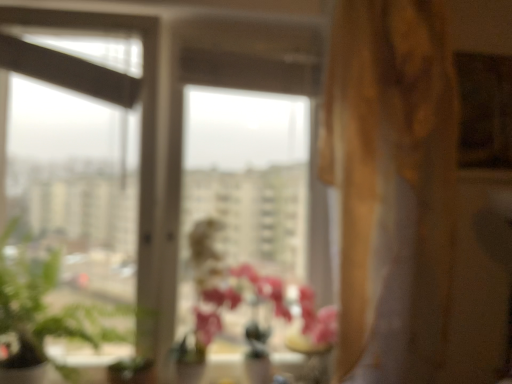
Question: From the image's perspective, is pink matte vase at center located above or below transparent glass vase at center?

Choices:
 (A) below
 (B) above

Answer: (B)

Question: Is pink matte vase at center in front of or behind transparent glass vase at center in the image?

Choices:
 (A) behind
 (B) front

Answer: (B)

Question: Based on their relative distances, which object is nearer to the gold textured curtain at right?

Choices:
 (A) pink matte vase at center
 (B) transparent glass vase at center
 (C) transparent glass window at center
 (D) green leafy plant at left

Answer: (A)

Question: Which object is the farthest from the gold textured curtain at right?

Choices:
 (A) green leafy plant at left
 (B) pink matte vase at center
 (C) transparent glass window at center
 (D) transparent glass vase at center

Answer: (A)